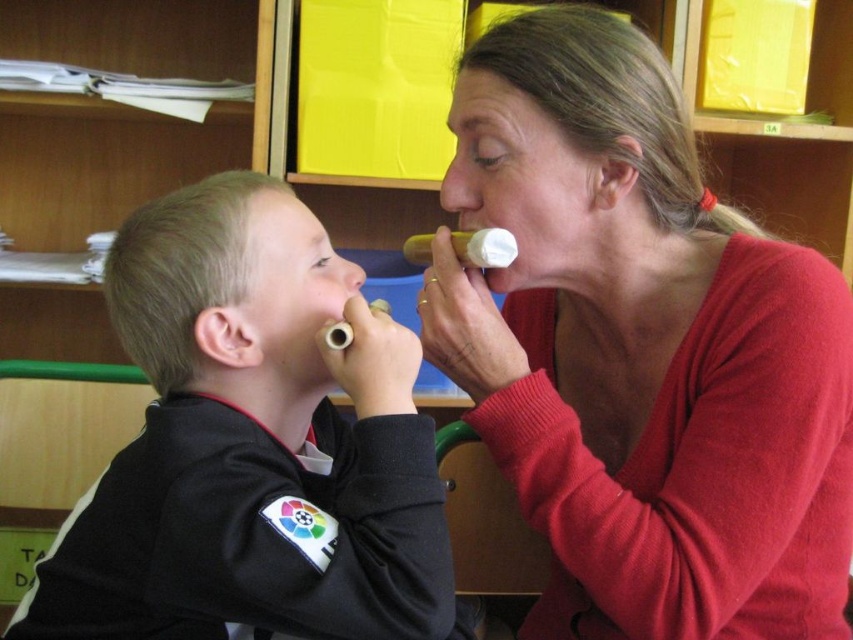
Can you confirm if smooth skin nose at upper center is taller than rubber teething ring at lower center?

Correct, smooth skin nose at upper center is much taller as rubber teething ring at lower center.

Is point (453, 177) positioned before point (425, 276)?

Yes, point (453, 177) is closer to viewer.

Describe the element at coordinates (463, 179) in the screenshot. I see `smooth skin nose at upper center` at that location.

Find the location of `smooth skin nose at upper center`. smooth skin nose at upper center is located at coordinates (463, 179).

Is matte white flute at center smaller than rubber teething ring at lower center?

Incorrect, matte white flute at center is not smaller in size than rubber teething ring at lower center.

At what (x,y) coordinates should I click in order to perform the action: click on matte white flute at center. Please return your answer as a coordinate pair (x, y). Looking at the image, I should click on (643, 353).

Does black matte jacket at left have a smaller size compared to smooth skin nose at upper center?

Incorrect, black matte jacket at left is not smaller in size than smooth skin nose at upper center.

Is point (253, 611) more distant than point (461, 160)?

No.

Where is `black matte jacket at left`? The image size is (853, 640). black matte jacket at left is located at coordinates (252, 444).